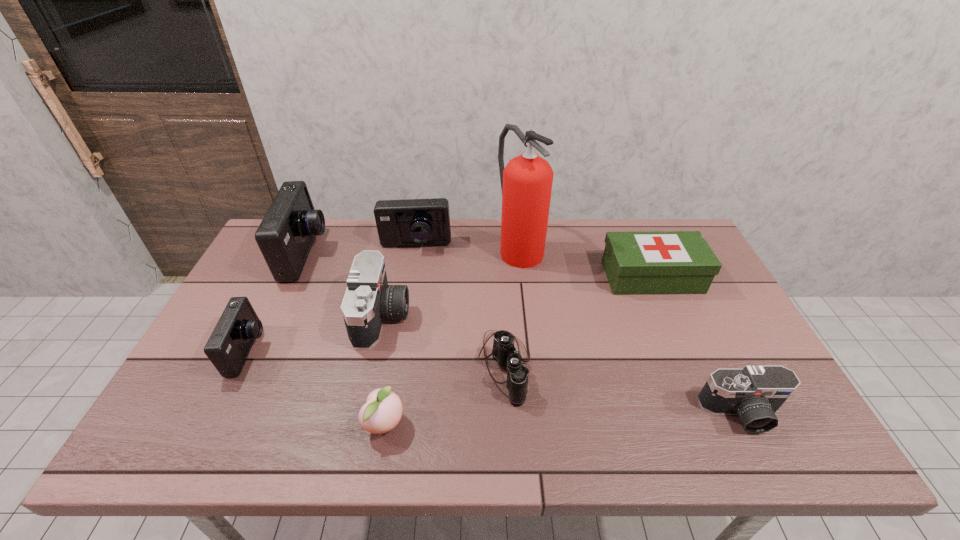
This screenshot has width=960, height=540. In order to click on free space that is in between the peach and the red fire extinguisher in this screenshot , I will do `click(452, 335)`.

Identify the location of free spot between the farther black camera and the second biggest blue camera. click(x=399, y=281).

The image size is (960, 540). Identify the location of vacant space in between the tallest camera and the rightmost camera. (524, 334).

Where is `free space between the binoculars and the red fire extinguisher`? The image size is (960, 540). free space between the binoculars and the red fire extinguisher is located at coordinates (512, 307).

At what (x,y) coordinates should I click in order to perform the action: click on vacant area that lies between the red fire extinguisher and the smaller black camera. Please return your answer as a coordinate pair (x, y). The width and height of the screenshot is (960, 540). Looking at the image, I should click on (631, 330).

Point out which object is positioned as the fifth nearest to the biggest blue camera. Please provide its 2D coordinates. Your answer should be formatted as a tuple, i.e. [(x, y)], where the tuple contains the x and y coordinates of a point satisfying the conditions above.

[(504, 352)]

The width and height of the screenshot is (960, 540). Identify the location of object that stands as the fifth closest to the tallest camera. (504, 352).

Identify which camera is the nearest to the rightmost blue camera. Please provide its 2D coordinates. Your answer should be formatted as a tuple, i.e. [(x, y)], where the tuple contains the x and y coordinates of a point satisfying the conditions above.

[(368, 300)]

Where is `the third closest camera relative to the tallest camera`? Image resolution: width=960 pixels, height=540 pixels. the third closest camera relative to the tallest camera is located at coordinates (412, 222).

Where is `blue camera that can be found as the second closest to the rightmost blue camera`? The image size is (960, 540). blue camera that can be found as the second closest to the rightmost blue camera is located at coordinates (228, 347).